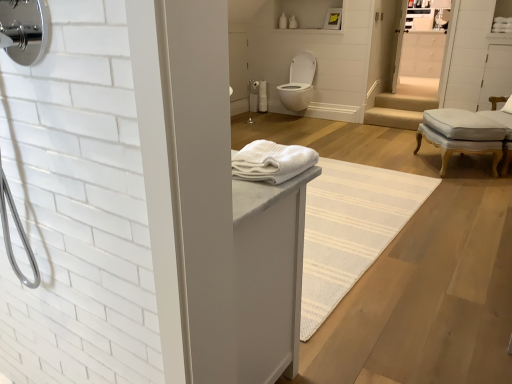
This screenshot has height=384, width=512. I want to click on free space underneath light gray fabric ottoman at right (from a real-world perspective), so click(x=460, y=164).